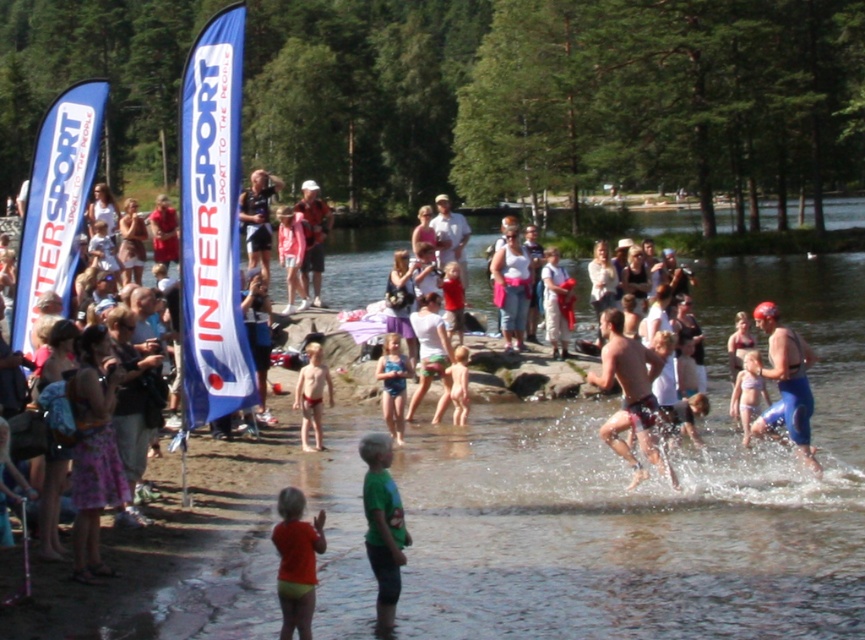
Is the position of blue spandex swim suit at right less distant than that of matte black shorts at center?

Yes, blue spandex swim suit at right is closer to the viewer.

Find the location of `blue spandex swim suit at right`. blue spandex swim suit at right is located at coordinates (786, 381).

This screenshot has height=640, width=865. Describe the element at coordinates (786, 381) in the screenshot. I see `blue spandex swim suit at right` at that location.

The height and width of the screenshot is (640, 865). I want to click on blue spandex swim suit at right, so click(786, 381).

Which of these two, matte red swimsuit at center or matte white dress at center, stands taller?

With more height is matte white dress at center.

Can you confirm if matte red swimsuit at center is positioned to the left of matte white dress at center?

Indeed, matte red swimsuit at center is positioned on the left side of matte white dress at center.

Is point (319, 355) in front of point (398, 273)?

That is True.

Locate an element on the screen. The width and height of the screenshot is (865, 640). matte red swimsuit at center is located at coordinates (312, 396).

Does blue spandex swim suit at right come behind light blue denim shorts at center?

No.

Does point (799, 433) come behind point (567, 330)?

No, (799, 433) is in front of (567, 330).

You are a GUI agent. You are given a task and a screenshot of the screen. Output one action in this format:
    pyautogui.click(x=<x>, y=<y>)
    Task: Click on the blue spandex swim suit at right
    The height and width of the screenshot is (640, 865).
    Given the screenshot: What is the action you would take?
    pyautogui.click(x=786, y=381)